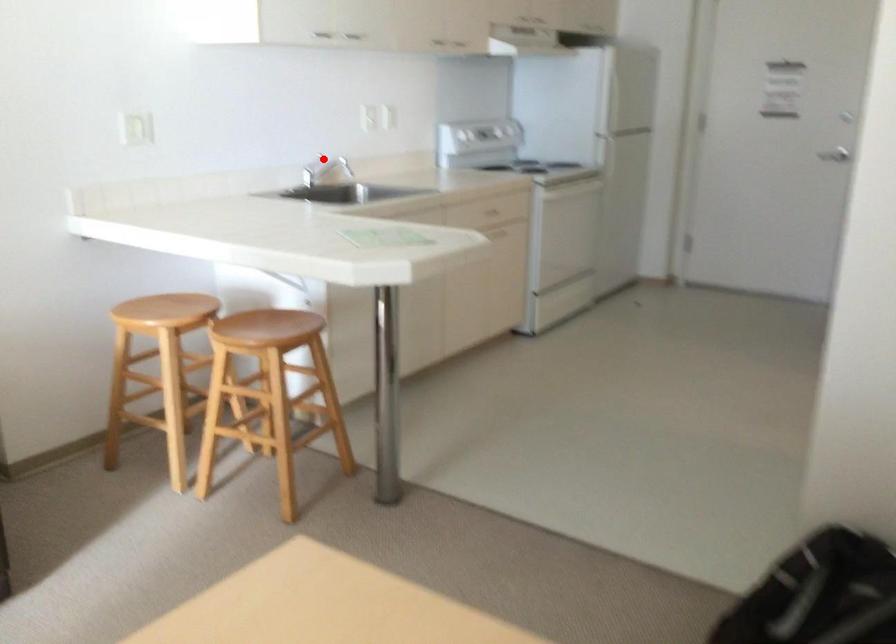
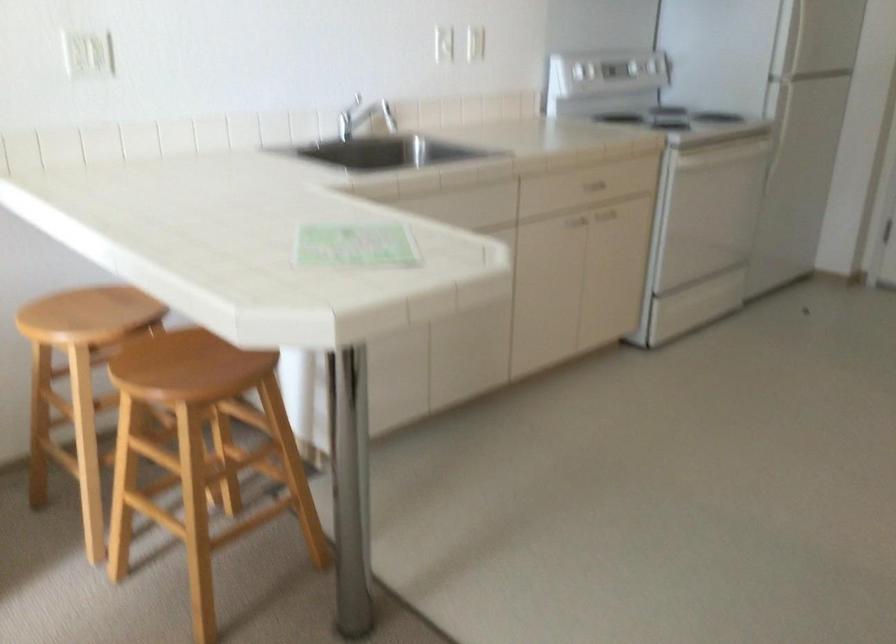
Question: A red point is marked in image1. In image2, is the corresponding 3D point closer to the camera or farther? Reply with the corresponding letter.

Choices:
 (A) The corresponding 3D point is closer.
 (B) The corresponding 3D point is farther.

Answer: (A)